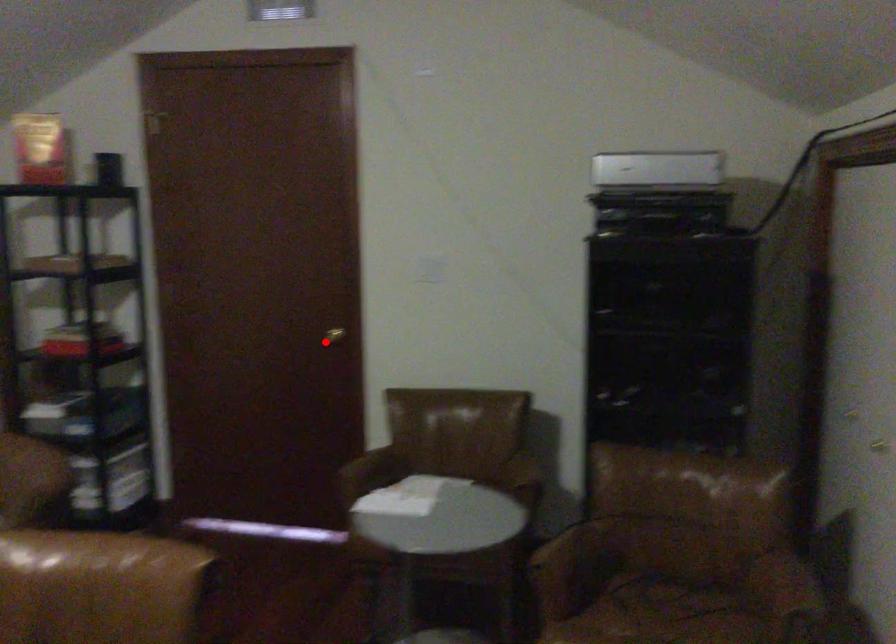
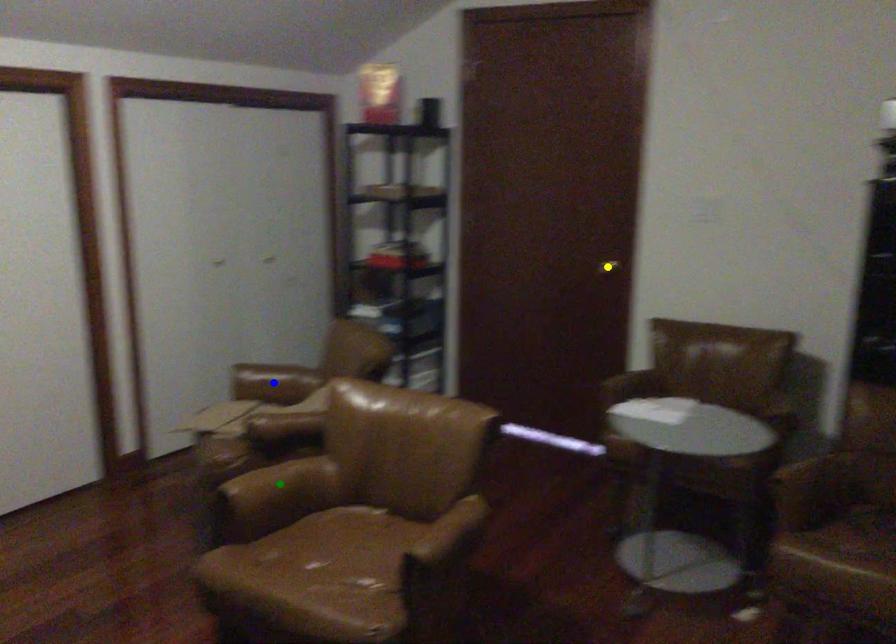
Question: I am providing you with two images of the same scene from different viewpoints. A red point is marked on the first image. You are given multiple points on the second image. Which spot in image 2 lines up with the point in image 1?

Choices:
 (A) yellow point
 (B) green point
 (C) blue point

Answer: (A)